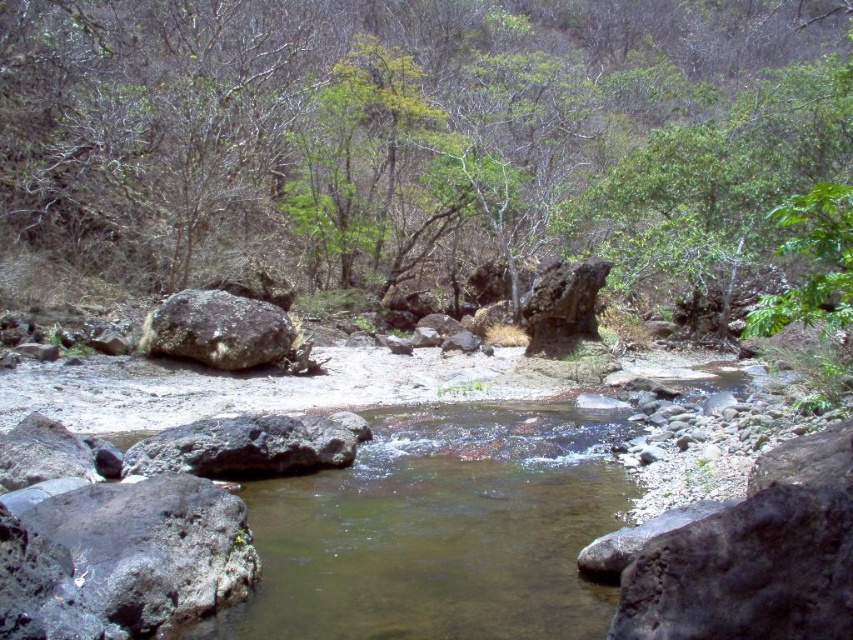
Based on the photo, can you confirm if clear water at center is positioned to the left of rusty metallic boulder at left?

Incorrect, clear water at center is not on the left side of rusty metallic boulder at left.

Between point (320, 490) and point (222, 291), which one is positioned behind?

The point (222, 291) is behind.

Which is behind, point (360, 451) or point (173, 337)?

Point (173, 337)

This screenshot has width=853, height=640. I want to click on clear water at center, so click(x=438, y=531).

Is clear water at center to the right of dark gray rock at center from the viewer's perspective?

Indeed, clear water at center is positioned on the right side of dark gray rock at center.

Which is in front, point (561, 573) or point (305, 420)?

Point (561, 573) is in front.

Between point (577, 516) and point (228, 432), which one is positioned in front?

Point (577, 516)

At what (x,y) coordinates should I click in order to perform the action: click on clear water at center. Please return your answer as a coordinate pair (x, y). The image size is (853, 640). Looking at the image, I should click on (438, 531).

Is gray rough rock at lower left thinner than dark gray rock at center?

Indeed, gray rough rock at lower left has a lesser width compared to dark gray rock at center.

Where is `gray rough rock at lower left`? The width and height of the screenshot is (853, 640). gray rough rock at lower left is located at coordinates (122, 557).